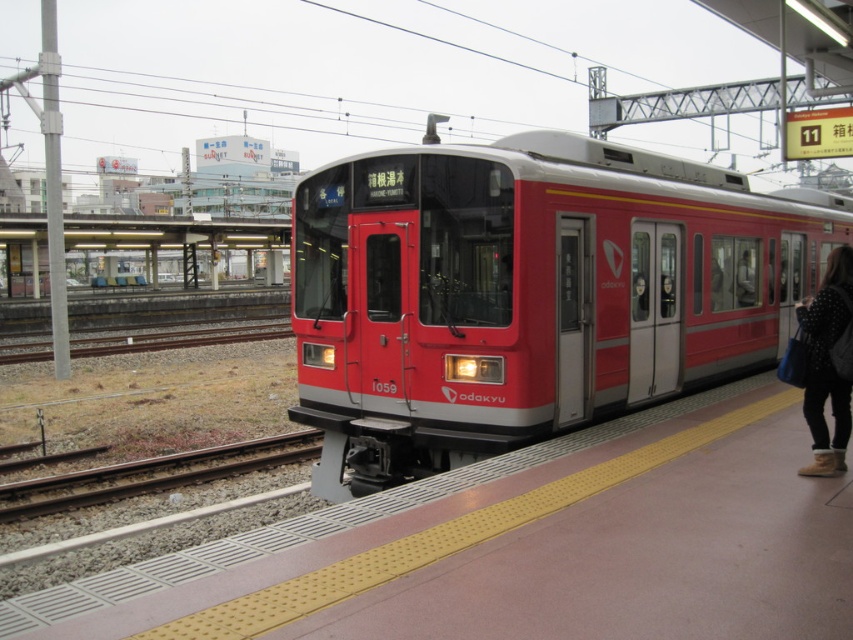
You are a photographer standing on the platform. You want to take a photo of the matte red train at center and the gravel railway track at lower left. Which object should you focus on first if you want to capture both in the frame without moving your camera?

The matte red train at center is bigger than the gravel railway track at lower left, so you should focus on the matte red train at center first to ensure it fills the frame appropriately before adjusting for the smaller gravel railway track at lower left.